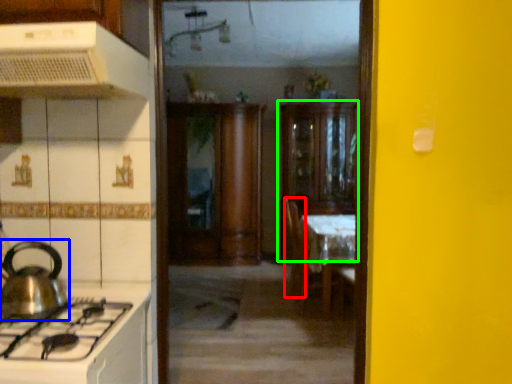
Question: Estimate the real-world distances between objects in this image. Which object is farther from chair (highlighted by a red box), kitchen appliance (highlighted by a blue box) or cabinetry (highlighted by a green box)?

Choices:
 (A) kitchen appliance
 (B) cabinetry

Answer: (A)